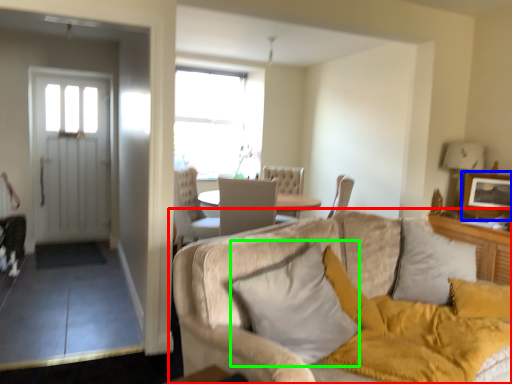
Question: Considering the real-world distances, which object is farthest from studio couch (highlighted by a red box)? picture frame (highlighted by a blue box) or pillow (highlighted by a green box)?

Choices:
 (A) picture frame
 (B) pillow

Answer: (A)